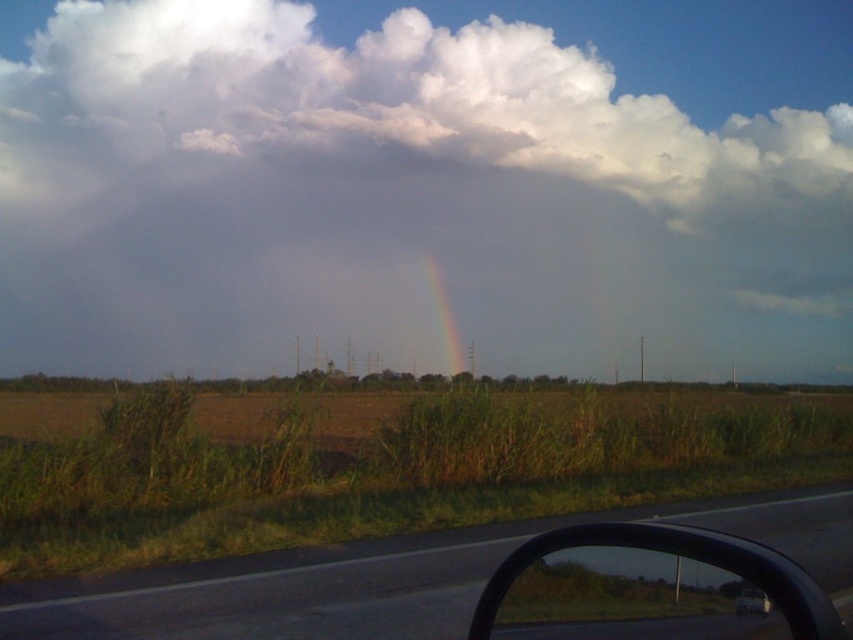
Identify the location of asphalt road at lower center. (281, 595).

Looking at this image, which is more to the right, asphalt road at lower center or white glossy car at lower right?

Positioned to the right is asphalt road at lower center.

Which is in front, point (33, 628) or point (764, 604)?

Point (764, 604) is in front.

Find the location of a particular element. asphalt road at lower center is located at coordinates (x=281, y=595).

Which is in front, point (630, 605) or point (737, 600)?

Point (737, 600)

Locate an element on the screen. transparent glass car window at lower right is located at coordinates pos(627,598).

Which of these two, white fluffy cloud at upper center or rainbow at center, stands shorter?

rainbow at center

Can you confirm if white fluffy cloud at upper center is positioned to the left of rainbow at center?

Indeed, white fluffy cloud at upper center is positioned on the left side of rainbow at center.

Does point (207, 275) come closer to viewer compared to point (440, 268)?

No, it is not.

Identify the location of white fluffy cloud at upper center. Image resolution: width=853 pixels, height=640 pixels. (425, 186).